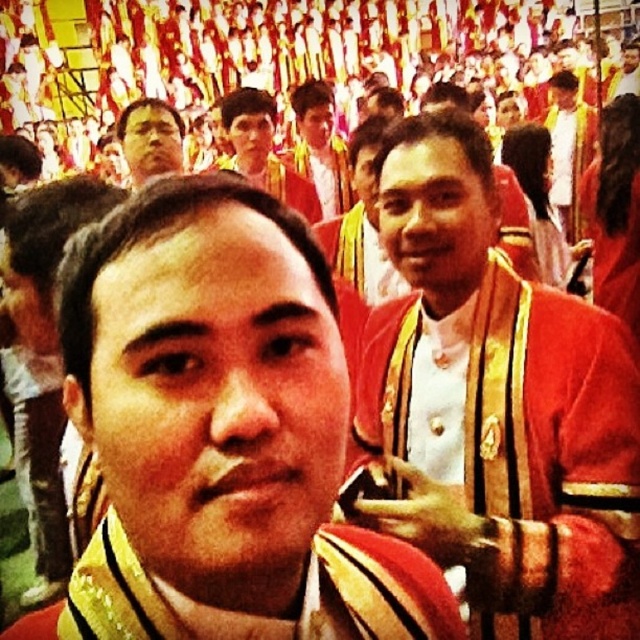
Question: Estimate the real-world distances between objects in this image. Which object is farther from the matte black face at upper center?

Choices:
 (A) shiny red jacket at center
 (B) shiny gold chain at center
 (C) matte gold medal at center

Answer: (B)

Question: Is the position of shiny red jacket at center more distant than that of matte gold medal at center?

Choices:
 (A) no
 (B) yes

Answer: (A)

Question: Does shiny red jacket at center have a smaller size compared to red velvet sash at center?

Choices:
 (A) yes
 (B) no

Answer: (B)

Question: Which object is the closest to the matte red jacket at center?

Choices:
 (A) matte black face at upper center
 (B) shiny gold chain at center
 (C) matte gold medal at center

Answer: (C)

Question: From the image, what is the correct spatial relationship of shiny red jacket at center in relation to matte gold medal at center?

Choices:
 (A) above
 (B) below

Answer: (B)

Question: Which object appears farthest from the camera in this image?

Choices:
 (A) matte red jacket at center
 (B) matte gold medal at center
 (C) shiny red jacket at center

Answer: (B)